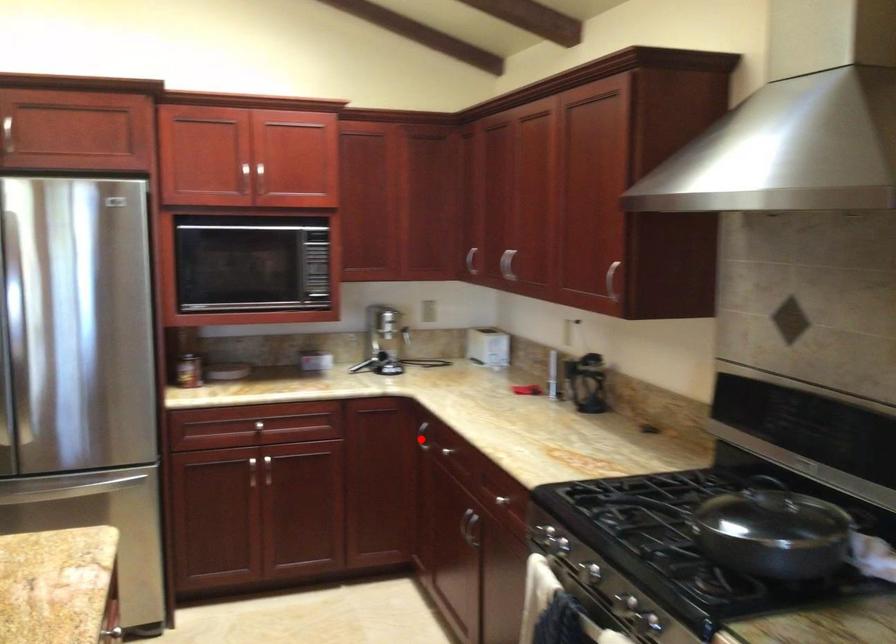
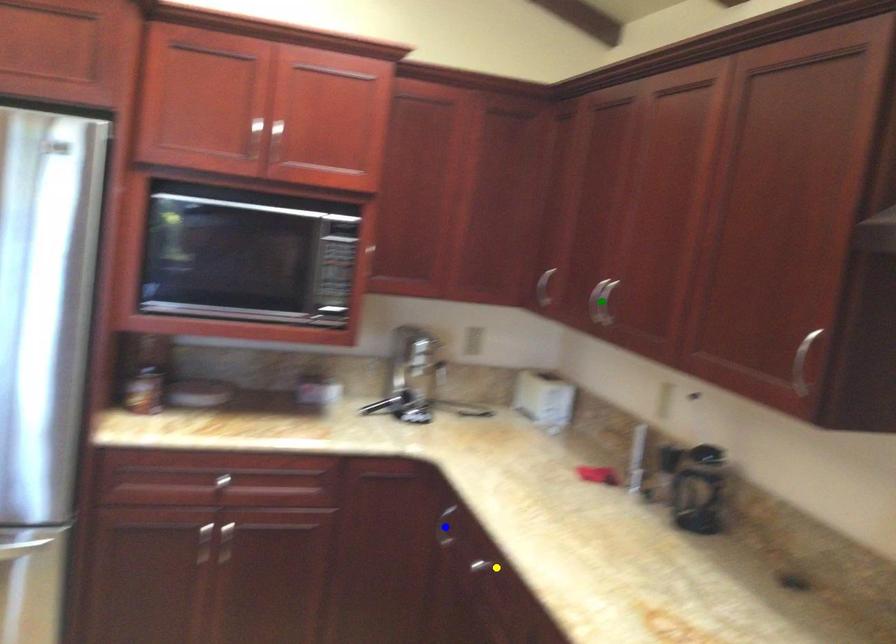
Question: I am providing you with two images of the same scene from different viewpoints. A red point is marked on the first image. You are given multiple points on the second image. Which mark in image 2 goes with the point in image 1?

Choices:
 (A) blue point
 (B) yellow point
 (C) green point

Answer: (A)